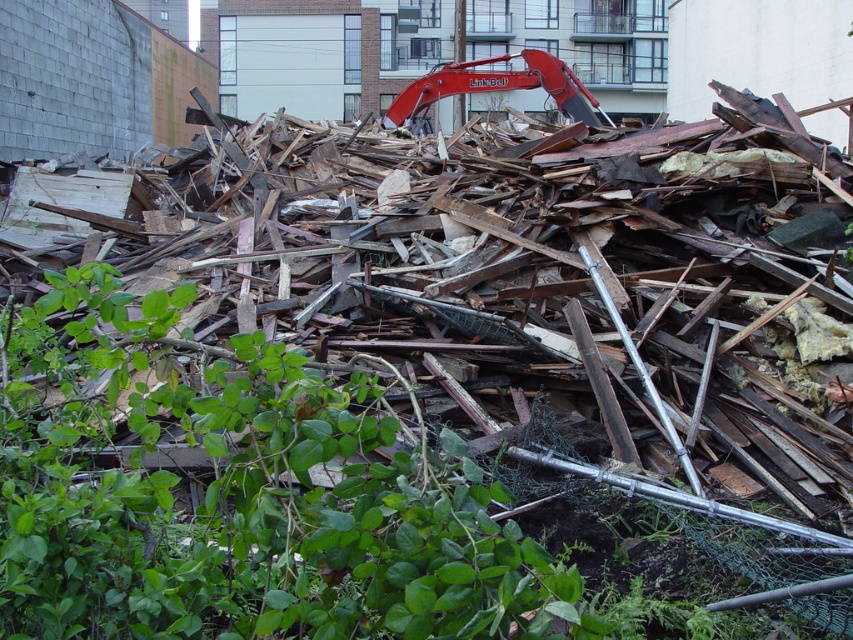
You are a construction worker who needs to retrieve a tool from the green leafy plant at lower left. The red metal excavator at upper center is blocking your path. Can you safely walk around the excavator to reach the plant without getting too close?

The distance between the green leafy plant at lower left and the red metal excavator at upper center is 11.20 meters, so there is enough space to walk around the excavator safely to reach the plant.

Looking at this image, you are standing at the center of the debris pile and want to find the green leafy plant at lower left. According to the 2D coordinates, in which direction should you move to reach it?

The green leafy plant at lower left is located at coordinates point (241, 499). Since you are at the center, you should move towards the lower left direction to reach it.

You are a construction worker assessing the debris site. You notice the green leafy plant at lower left and the red metal excavator at upper center. Which object is located higher in the scene?

The red metal excavator at upper center is higher than the green leafy plant at lower left.